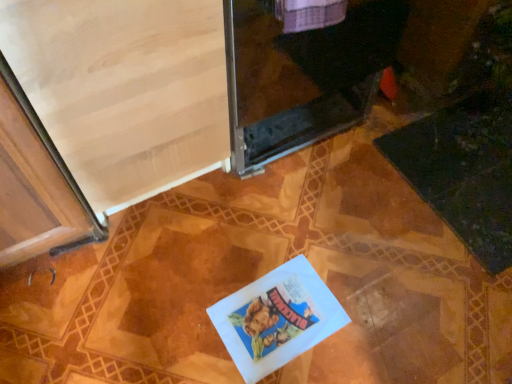
In order to face white paper book at center, should I rotate leftwards or rightwards?

Turn right approximately 2.907 degrees to face it.

How much space does transparent glass screen door at upper center, positioned as the second screen door in left-to-right order, occupy vertically?

It is 23.71 inches.

I want to click on white paper book at center, so (277, 318).

Is white paper book at center at the right side of transparent glass screen door at upper center, positioned as the second screen door in left-to-right order?

Indeed, white paper book at center is positioned on the right side of transparent glass screen door at upper center, positioned as the second screen door in left-to-right order.

The image size is (512, 384). I want to click on screen door that is the 1st object located in front of the white paper book at center, so click(x=302, y=71).

Is white paper book at center positioned before transparent glass screen door at upper center, positioned as the second screen door in left-to-right order?

No, white paper book at center is further to the viewer.

Does point (320, 291) come farther from viewer compared to point (229, 13)?

Yes, point (320, 291) is behind point (229, 13).

Is transparent glass screen door at upper center, the first screen door when ordered from right to left, not inside white paper book at center?

Yes, transparent glass screen door at upper center, the first screen door when ordered from right to left, is outside of white paper book at center.

Considering the sizes of objects transparent glass screen door at upper center, positioned as the second screen door in left-to-right order, and white paper book at center in the image provided, who is taller, transparent glass screen door at upper center, positioned as the second screen door in left-to-right order, or white paper book at center?

transparent glass screen door at upper center, positioned as the second screen door in left-to-right order.

In the scene shown: Could you tell me if transparent glass screen door at upper center, the first screen door when ordered from right to left, is turned towards white paper book at center?

Yes, transparent glass screen door at upper center, the first screen door when ordered from right to left, is turned towards white paper book at center.

Considering the relative sizes of transparent glass screen door at upper center, the first screen door when ordered from right to left, and white paper book at center in the image provided, is transparent glass screen door at upper center, the first screen door when ordered from right to left, wider than white paper book at center?

Yes, transparent glass screen door at upper center, the first screen door when ordered from right to left, is wider than white paper book at center.

Is white paper book at center positioned with its back to light wood screen door at upper left, which appears as the second screen door when viewed from the right?

Yes, white paper book at center is positioned with its back facing light wood screen door at upper left, which appears as the second screen door when viewed from the right.

Would you say white paper book at center is outside light wood screen door at upper left, the first screen door positioned from the left?

Yes, white paper book at center is located beyond the bounds of light wood screen door at upper left, the first screen door positioned from the left.

Is white paper book at center wider or thinner than light wood screen door at upper left, the first screen door positioned from the left?

Clearly, white paper book at center has less width compared to light wood screen door at upper left, the first screen door positioned from the left.

Where is `the 2nd screen door above the white paper book at center (from a real-world perspective)`? The height and width of the screenshot is (384, 512). the 2nd screen door above the white paper book at center (from a real-world perspective) is located at coordinates (124, 89).

Can you confirm if light wood screen door at upper left, the first screen door positioned from the left, is positioned to the right of transparent glass screen door at upper center, the first screen door when ordered from right to left?

No, light wood screen door at upper left, the first screen door positioned from the left, is not to the right of transparent glass screen door at upper center, the first screen door when ordered from right to left.

Can you confirm if light wood screen door at upper left, the first screen door positioned from the left, is shorter than transparent glass screen door at upper center, the first screen door when ordered from right to left?

No.

Choose the correct answer: Is light wood screen door at upper left, the first screen door positioned from the left, inside transparent glass screen door at upper center, the first screen door when ordered from right to left, or outside it?

light wood screen door at upper left, the first screen door positioned from the left, is not enclosed by transparent glass screen door at upper center, the first screen door when ordered from right to left.

Consider the image. Could you measure the distance between light wood screen door at upper left, the first screen door positioned from the left, and white paper book at center?

light wood screen door at upper left, the first screen door positioned from the left, and white paper book at center are 20.13 inches apart from each other.

Could you tell me if light wood screen door at upper left, which appears as the second screen door when viewed from the right, is turned towards white paper book at center?

Yes, light wood screen door at upper left, which appears as the second screen door when viewed from the right, is facing white paper book at center.

From the image's perspective, who appears lower, light wood screen door at upper left, which appears as the second screen door when viewed from the right, or white paper book at center?

white paper book at center.

Which object is thinner, light wood screen door at upper left, the first screen door positioned from the left, or white paper book at center?

With smaller width is white paper book at center.

Which of these two, transparent glass screen door at upper center, the first screen door when ordered from right to left, or light wood screen door at upper left, which appears as the second screen door when viewed from the right, is wider?

With larger width is transparent glass screen door at upper center, the first screen door when ordered from right to left.

Where is `screen door located underneath the light wood screen door at upper left, which appears as the second screen door when viewed from the right (from a real-world perspective)`? The height and width of the screenshot is (384, 512). screen door located underneath the light wood screen door at upper left, which appears as the second screen door when viewed from the right (from a real-world perspective) is located at coordinates 302,71.

In the scene shown: Considering the sizes of objects transparent glass screen door at upper center, positioned as the second screen door in left-to-right order, and light wood screen door at upper left, which appears as the second screen door when viewed from the right, in the image provided, who is smaller, transparent glass screen door at upper center, positioned as the second screen door in left-to-right order, or light wood screen door at upper left, which appears as the second screen door when viewed from the right,?

Smaller between the two is transparent glass screen door at upper center, positioned as the second screen door in left-to-right order.

Which is correct: transparent glass screen door at upper center, the first screen door when ordered from right to left, is inside light wood screen door at upper left, which appears as the second screen door when viewed from the right, or outside of it?

transparent glass screen door at upper center, the first screen door when ordered from right to left, is not inside light wood screen door at upper left, which appears as the second screen door when viewed from the right, it's outside.

Where is `book on the right side of transparent glass screen door at upper center, the first screen door when ordered from right to left`? book on the right side of transparent glass screen door at upper center, the first screen door when ordered from right to left is located at coordinates (277, 318).

The width and height of the screenshot is (512, 384). I want to click on the 1st screen door positioned above the white paper book at center (from a real-world perspective), so click(302, 71).

Looking at the image, which one is located further to white paper book at center, transparent glass screen door at upper center, positioned as the second screen door in left-to-right order, or light wood screen door at upper left, the first screen door positioned from the left?

transparent glass screen door at upper center, positioned as the second screen door in left-to-right order, is further to white paper book at center.

From the image, which object appears to be farther from light wood screen door at upper left, which appears as the second screen door when viewed from the right, transparent glass screen door at upper center, positioned as the second screen door in left-to-right order, or white paper book at center?

white paper book at center is further to light wood screen door at upper left, which appears as the second screen door when viewed from the right.

Which object lies nearer to the anchor point transparent glass screen door at upper center, positioned as the second screen door in left-to-right order, light wood screen door at upper left, the first screen door positioned from the left, or white paper book at center?

light wood screen door at upper left, the first screen door positioned from the left.

From the image, which object appears to be farther from white paper book at center, light wood screen door at upper left, which appears as the second screen door when viewed from the right, or transparent glass screen door at upper center, the first screen door when ordered from right to left?

The object further to white paper book at center is transparent glass screen door at upper center, the first screen door when ordered from right to left.

Estimate the real-world distances between objects in this image. Which object is closer to transparent glass screen door at upper center, the first screen door when ordered from right to left, white paper book at center or light wood screen door at upper left, which appears as the second screen door when viewed from the right?

The object closer to transparent glass screen door at upper center, the first screen door when ordered from right to left, is light wood screen door at upper left, which appears as the second screen door when viewed from the right.

Based on their spatial positions, is white paper book at center or transparent glass screen door at upper center, the first screen door when ordered from right to left, further from light wood screen door at upper left, which appears as the second screen door when viewed from the right?

Based on the image, white paper book at center appears to be further to light wood screen door at upper left, which appears as the second screen door when viewed from the right.

The image size is (512, 384). Find the location of `screen door between transparent glass screen door at upper center, positioned as the second screen door in left-to-right order, and white paper book at center vertically`. screen door between transparent glass screen door at upper center, positioned as the second screen door in left-to-right order, and white paper book at center vertically is located at coordinates (124, 89).